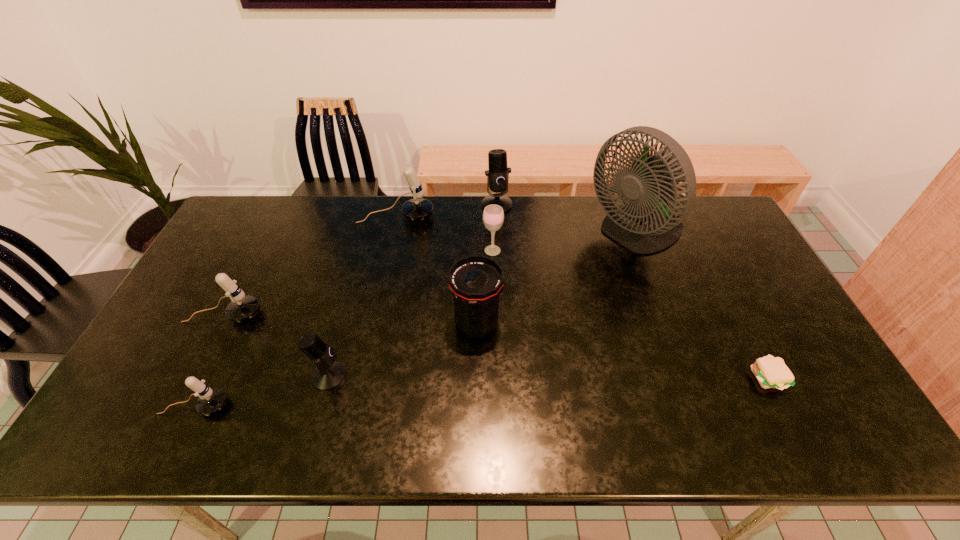
The height and width of the screenshot is (540, 960). I want to click on the fourth farthest microphone, so click(x=329, y=373).

Find the location of `the left black microphone`. the left black microphone is located at coordinates (329, 373).

The height and width of the screenshot is (540, 960). In order to click on the nearest white microphone in this screenshot , I will do `click(210, 401)`.

Locate an element on the screen. the nearest microphone is located at coordinates (210, 401).

The width and height of the screenshot is (960, 540). In order to click on patty in this screenshot , I will do `click(771, 372)`.

What are the coordinates of `vacant region located in front of the gray fan to direct airflow` in the screenshot? It's located at (518, 234).

Where is `blank space located 0.280m in front of the gray fan to direct airflow`? blank space located 0.280m in front of the gray fan to direct airflow is located at coordinates (504, 234).

Locate an element on the screen. This screenshot has height=540, width=960. free space located 0.400m in front of the gray fan to direct airflow is located at coordinates (468, 234).

Image resolution: width=960 pixels, height=540 pixels. Identify the location of free spot located 0.400m on the stand of the rightmost microphone. (501, 299).

This screenshot has width=960, height=540. What are the coordinates of `vacant space located 0.310m on the front of the rightmost white microphone` in the screenshot? It's located at (380, 294).